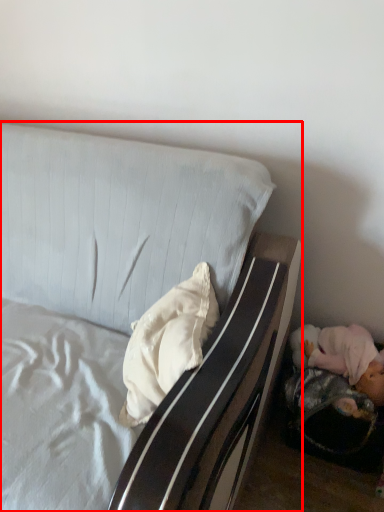
Question: Where is bed (annotated by the red box) located in relation to pillow in the image?

Choices:
 (A) left
 (B) right

Answer: (A)